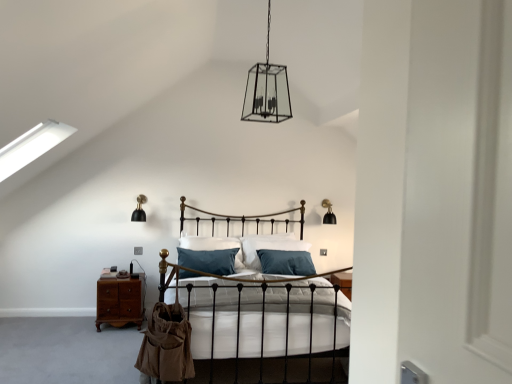
Locate an element on the screen. The height and width of the screenshot is (384, 512). free space to the left of mahogany wood nightstand at lower left is located at coordinates (77, 320).